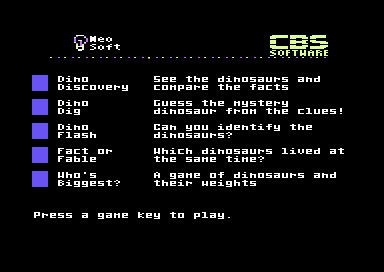
The height and width of the screenshot is (272, 384). I want to click on black screen, so click(x=156, y=250).